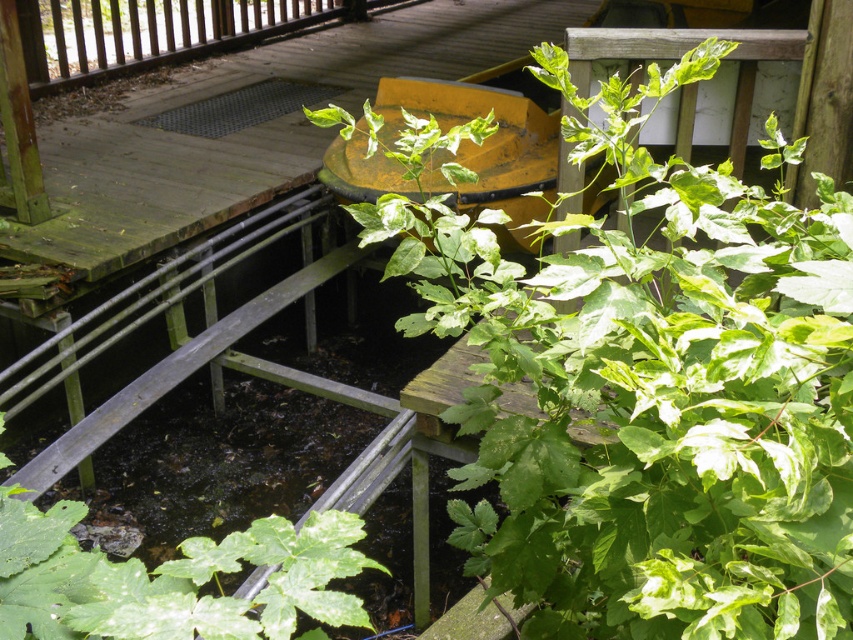
Looking at this image, you are standing on the wooden deck and see the green leafy plant at center and the green matte leafy plant at lower left. Which plant is closer to you?

The green leafy plant at center is positioned over the green matte leafy plant at lower left, meaning it is closer to you.

You are standing on the wooden deck and looking towards the water feature. Which green leafy plant is closer to you, the green leafy plant at center or the green matte leafy plant at lower left?

The green leafy plant at center is closer to you because it is in front of the green matte leafy plant at lower left.